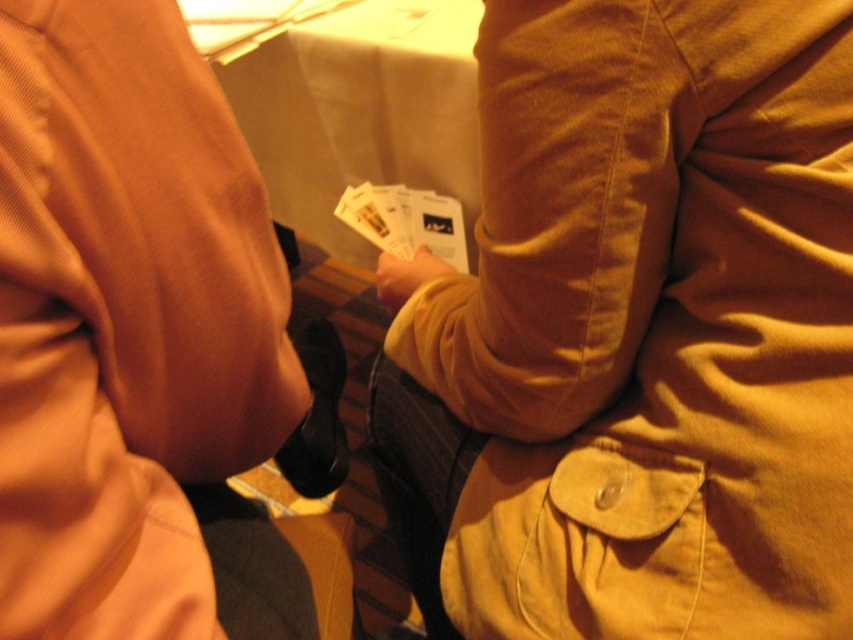
You are at an event and need to find the matte brown jacket at center and the matte orange jacket at upper left. Which one is positioned lower in the image?

The matte brown jacket at center is positioned lower than the matte orange jacket at upper left.

You are a photographer trying to capture a candid shot of the matte orange jacket at upper left and the matte yellow hand at center. Since you want to ensure both subjects are in focus, you need to know which one is taller. Can you tell me which object is taller?

The matte orange jacket at upper left is taller than the matte yellow hand at center, so you should adjust your camera settings to focus on the taller object first.

You are at an event and see two people sitting together. You notice the matte brown jacket at center and the matte yellow hand at center. Which object is positioned more to the left?

The matte yellow hand at center is positioned more to the left than the matte brown jacket at center.